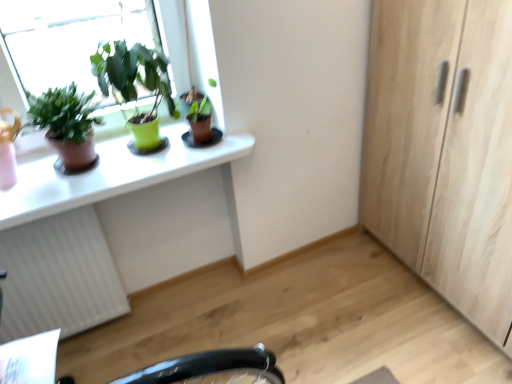
Image resolution: width=512 pixels, height=384 pixels. Find the location of `vacant area situated below white glossy desk at upper left (from a real-world perspective)`. vacant area situated below white glossy desk at upper left (from a real-world perspective) is located at coordinates pyautogui.click(x=182, y=305).